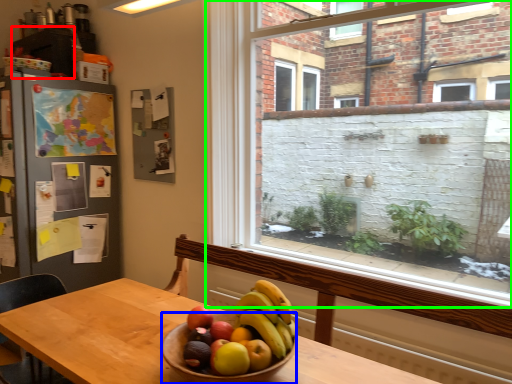
Question: Which is farther away from cabinetry (highlighted by a red box)? bowl (highlighted by a blue box) or window (highlighted by a green box)?

Choices:
 (A) bowl
 (B) window

Answer: (A)